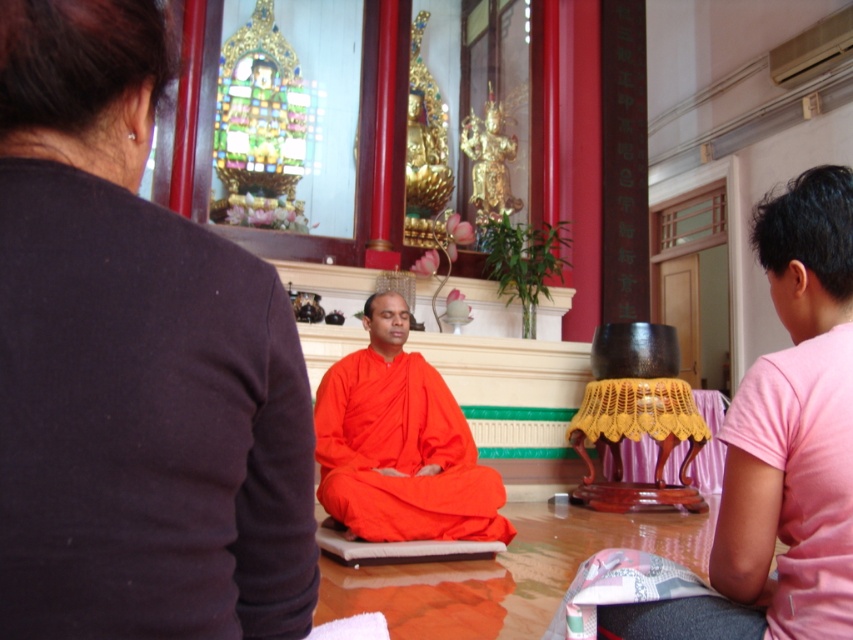
You are an interior designer assessing the space for a new piece of furniture. You notice the dark brown fabric at upper left and the orange silk dhoti at center. Which object takes up more visual space in the scene?

The orange silk dhoti at center occupies more visual space than the dark brown fabric at upper left.

You are standing in the temple and want to place a small offering on the dark brown fabric at upper left and the orange cloth at center. Which object is closer to you where you can place it easily?

The dark brown fabric at upper left is closer to the viewer than the orange cloth at center, so you can place the offering there more easily.